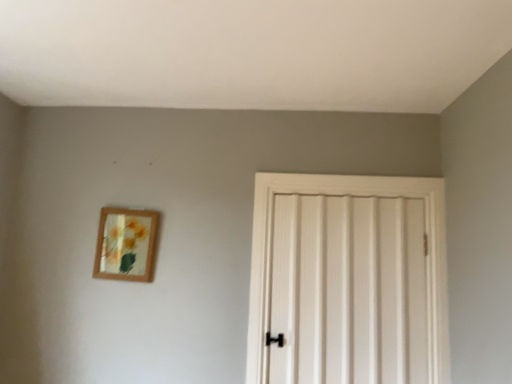
Question: Considering the relative positions of white wooden door at center and wooden frame at upper left in the image provided, is white wooden door at center to the left or to the right of wooden frame at upper left?

Choices:
 (A) right
 (B) left

Answer: (A)

Question: Is point (266, 306) positioned closer to the camera than point (103, 266)?

Choices:
 (A) farther
 (B) closer

Answer: (B)

Question: From the image's perspective, is white wooden door at center located above or below wooden frame at upper left?

Choices:
 (A) above
 (B) below

Answer: (B)

Question: Based on their sizes in the image, would you say wooden frame at upper left is bigger or smaller than white wooden door at center?

Choices:
 (A) big
 (B) small

Answer: (B)

Question: Is wooden frame at upper left wider or thinner than white wooden door at center?

Choices:
 (A) thin
 (B) wide

Answer: (A)

Question: Considering their positions, is wooden frame at upper left located in front of or behind white wooden door at center?

Choices:
 (A) behind
 (B) front

Answer: (A)

Question: Is wooden frame at upper left to the left or to the right of white wooden door at center in the image?

Choices:
 (A) right
 (B) left

Answer: (B)